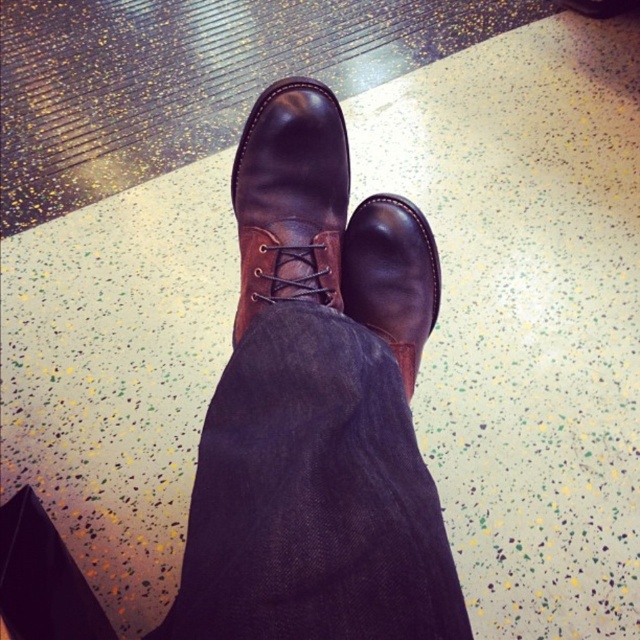
The width and height of the screenshot is (640, 640). In order to click on dark blue denim jeans at center in this screenshot , I will do `click(312, 497)`.

Is point (230, 532) closer to camera compared to point (397, 285)?

Yes, it is.

In order to click on dark blue denim jeans at center in this screenshot , I will do `click(312, 497)`.

In the scene shown: Can you confirm if dark blue denim jeans at center is positioned below shiny brown leather boot at center?

Correct, dark blue denim jeans at center is located below shiny brown leather boot at center.

Between dark blue denim jeans at center and shiny brown leather boot at center, which one is positioned higher?

shiny brown leather boot at center is higher up.

Between point (323, 550) and point (292, 157), which one is positioned in front?

Point (323, 550) is more forward.

Where is `dark blue denim jeans at center`? The image size is (640, 640). dark blue denim jeans at center is located at coordinates (312, 497).

Can you confirm if shiny brown leather boot at center is bigger than brown leather boot at center?

Yes.

Where is `shiny brown leather boot at center`? This screenshot has width=640, height=640. shiny brown leather boot at center is located at coordinates (291, 198).

The height and width of the screenshot is (640, 640). I want to click on shiny brown leather boot at center, so click(x=291, y=198).